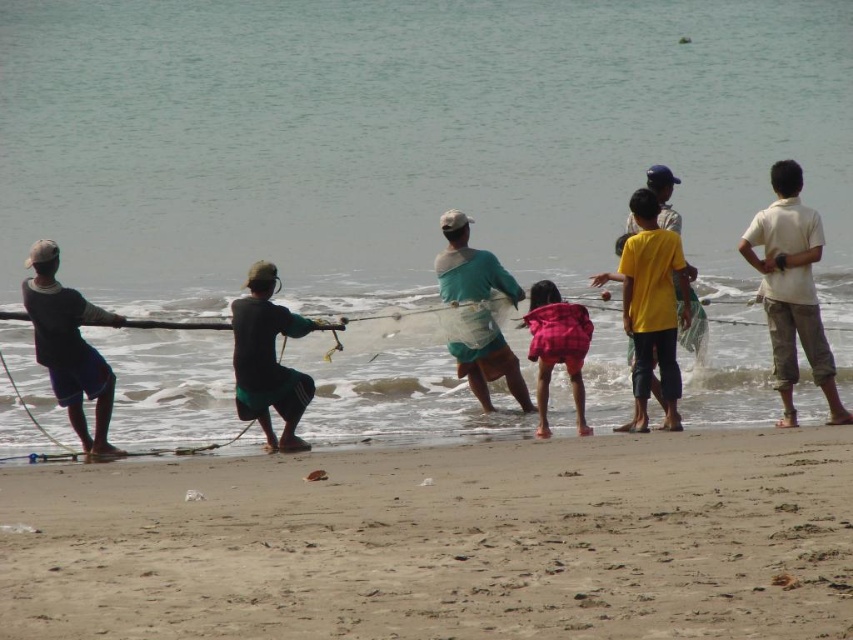
You are standing at the origin point of the coordinate system. You want to walk to the sandy beach at lower center. What direction should you go?

The sandy beach at lower center is located at coordinate point (442, 541), so you should move towards the right and upwards from your current position at the origin.

You are a photographer trying to capture the sandy beach at lower center and the black matte shorts at center in a single shot. Based on their positions, which object should you focus on first to ensure both are in sharp focus?

The sandy beach at lower center is closer to the viewer than the black matte shorts at center. To ensure both are in sharp focus, you should focus on the black matte shorts at center because focusing on the farther object allows for a greater depth of field that can include the closer object as well.